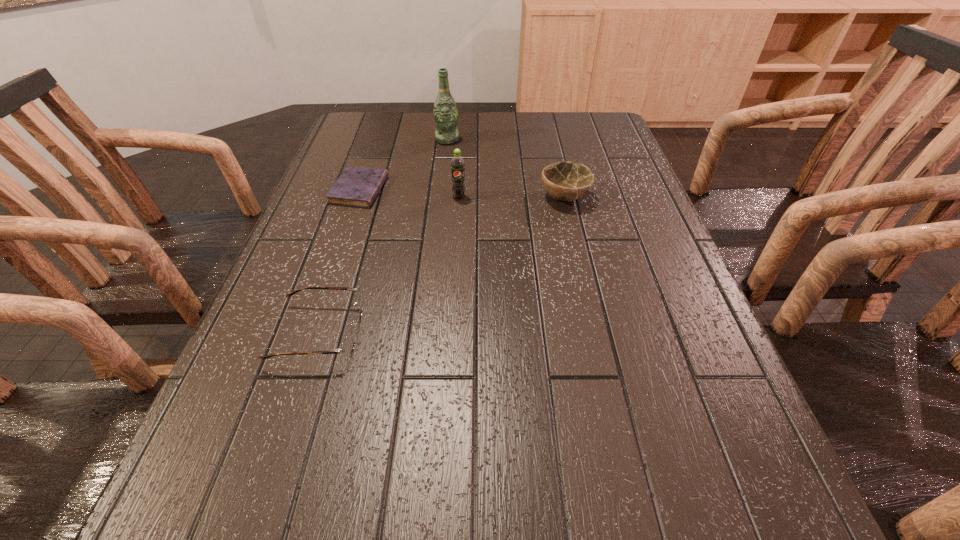
Identify the location of the farthest object. (445, 113).

Locate an element on the screen. The height and width of the screenshot is (540, 960). the tallest object is located at coordinates (445, 113).

This screenshot has height=540, width=960. In order to click on soda in this screenshot , I will do `click(457, 164)`.

This screenshot has width=960, height=540. I want to click on the rightmost object, so click(566, 181).

Image resolution: width=960 pixels, height=540 pixels. I want to click on bowl, so click(566, 181).

Locate an element on the screen. This screenshot has height=540, width=960. the fourth tallest object is located at coordinates (347, 346).

In order to click on the nearest object in this screenshot , I will do `click(347, 346)`.

The width and height of the screenshot is (960, 540). I want to click on diary, so click(358, 187).

Where is `blank area located on the surface of the beer bottle`? The image size is (960, 540). blank area located on the surface of the beer bottle is located at coordinates (444, 171).

Identify the location of vacant area situated 0.320m on the front label of the second tallest object. Image resolution: width=960 pixels, height=540 pixels. (453, 292).